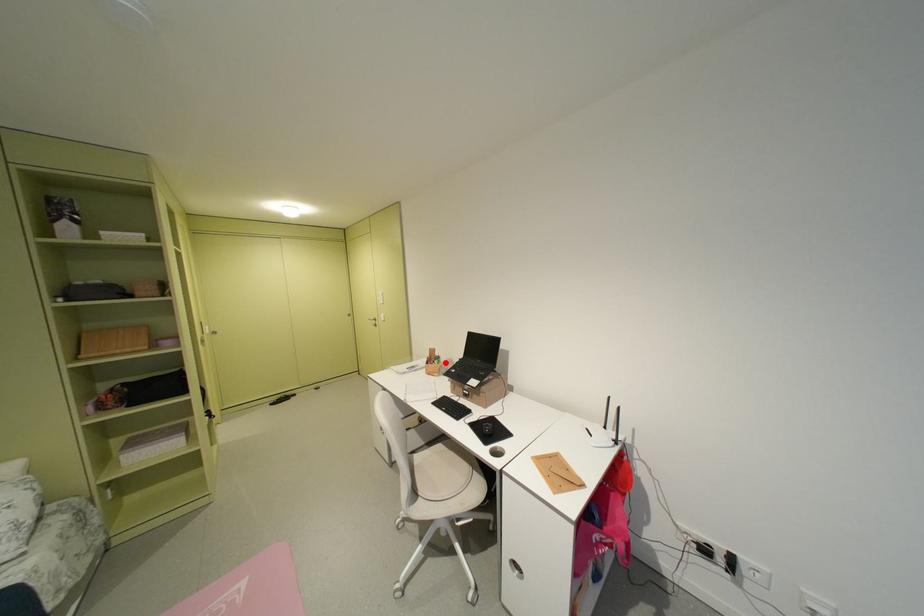
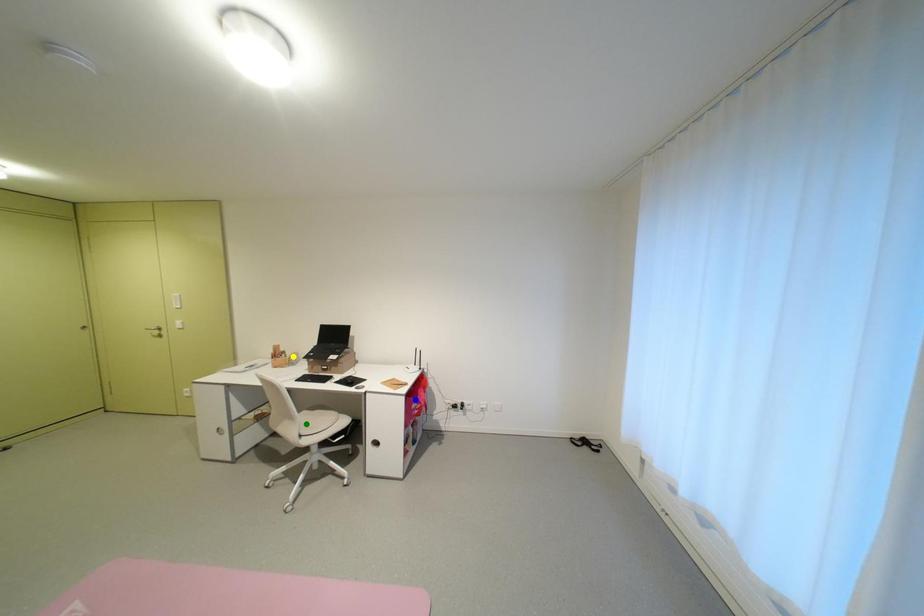
Question: I am providing you with two images of the same scene from different viewpoints. A red point is marked on the first image. You are given multiple points on the second image. Can you choose the point in image 2 that corresponds to the point in image 1?

Choices:
 (A) green point
 (B) yellow point
 (C) blue point

Answer: (B)